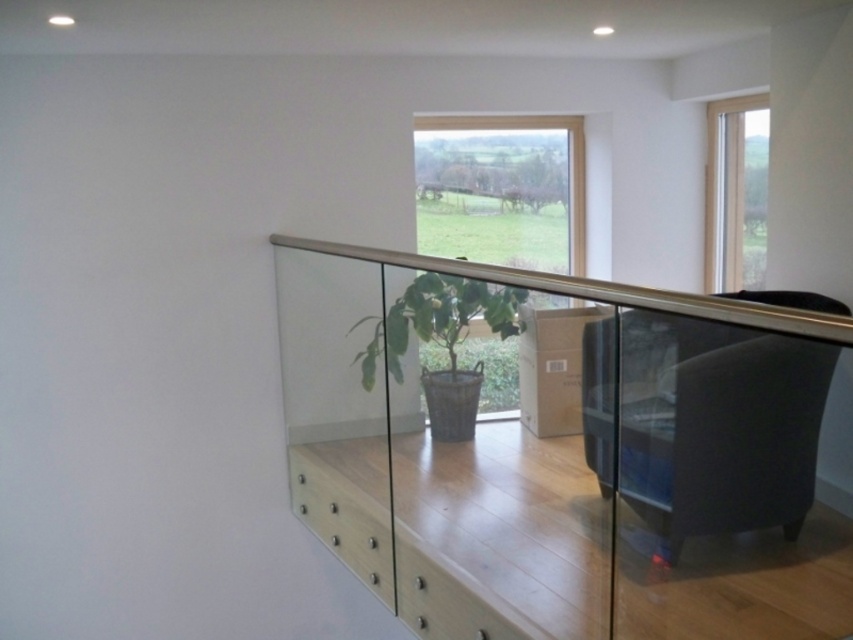
You are sitting in the black leather chair at right and want to reach the green matte plant at center to water it. Can you comfortably reach the plant without leaving your seat?

The distance between the black leather chair at right and the green matte plant at center is 1.22 meters. Since this distance is greater than the typical comfortable reaching distance of about 1 meter, you would likely need to move closer to water the plant comfortably.

You are standing at the center of the room and want to sit down. The black leather chair at right is located at coordinates 0.666 on the x and 0.842 on the y axis. Can you walk straight to it without obstacles?

The black leather chair at right is located at coordinates 0.666 on the x and 0.842 on the y axis. Since there are no obstacles mentioned between your current position at the center and the chair, you can walk straight to it.

You are standing in the modern interior space and want to place a new potted plant that is 1.5 meters tall. The current green matte plant at center is 1 meter tall. Can the new plant fit in the same spot without exceeding the height of the clear glass window at center?

The green matte plant at center is shorter than the clear glass window at center. Since the new plant is 1.5 meters tall and the current plant is 1 meter, the new plant is taller. However, as the existing plant is already shorter than the window, the new plant may still fit if the window is taller than 1.5 meters. But since the exact height of the window isn